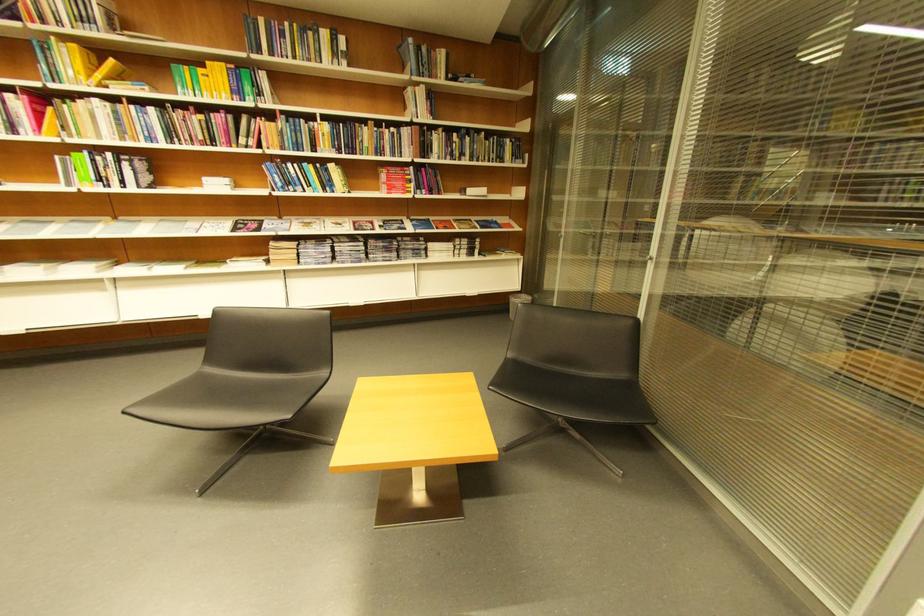
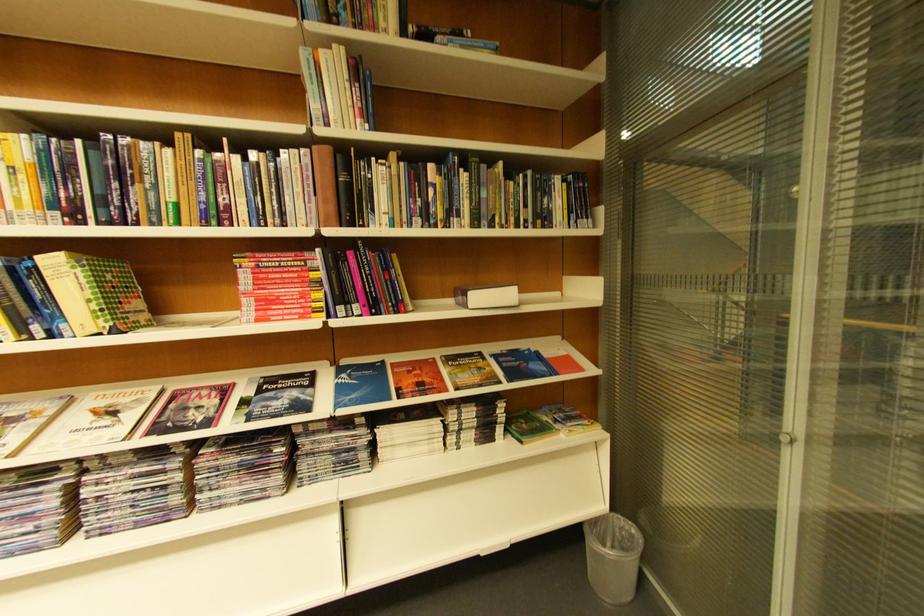
Where in the second image is the point corresponding to the point at 403,172 from the first image?

(281, 262)